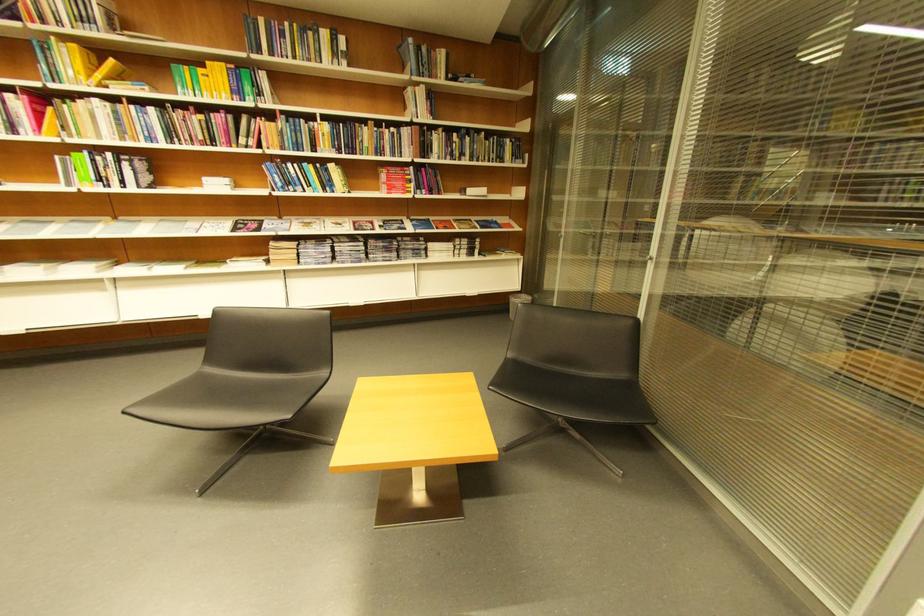
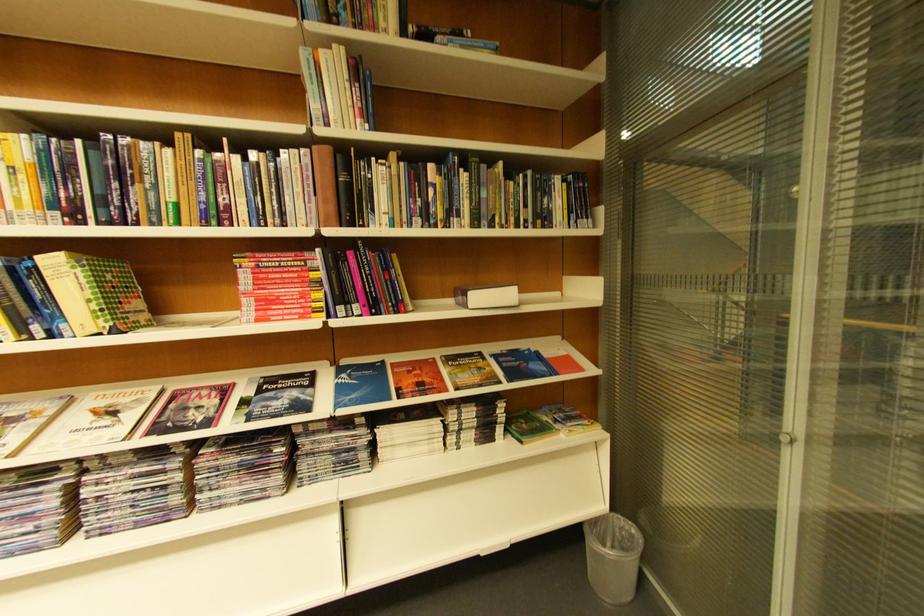
Where in the second image is the point corresponding to the point at 403,172 from the first image?

(281, 262)